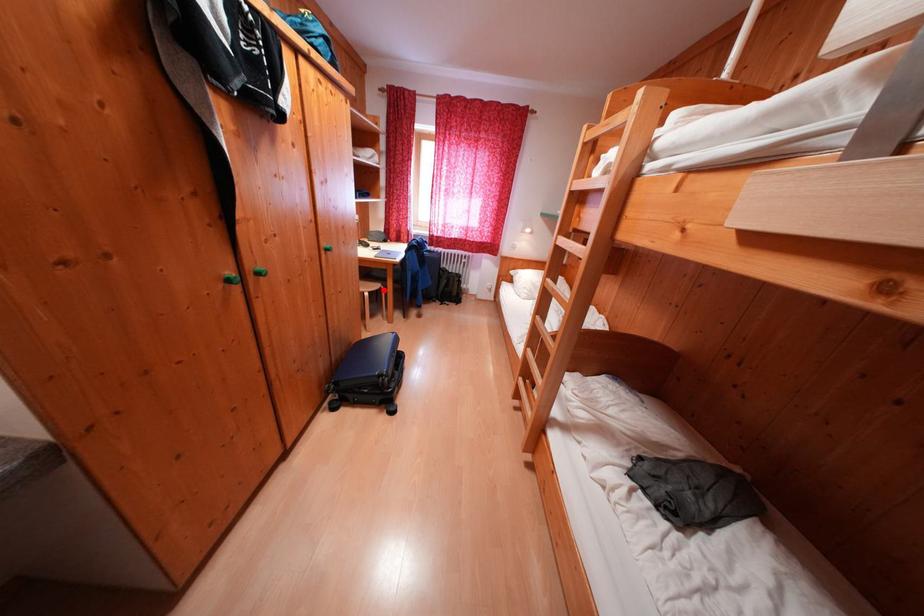
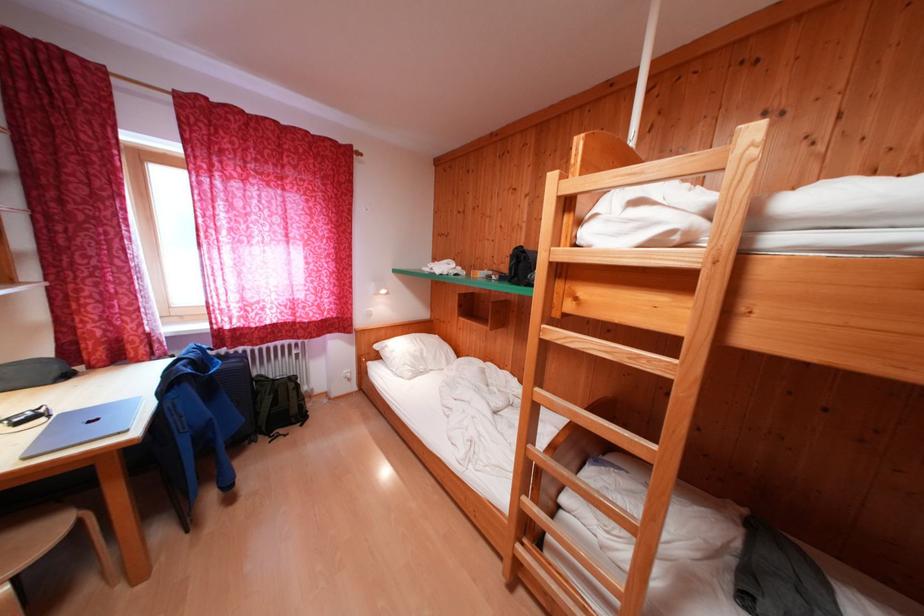
Question: I am providing you with two images of the same scene from different viewpoints. In image1, a red point is highlighted. Considering the same 3D point in image2, which of the following is correct?

Choices:
 (A) It is closer
 (B) It is farther

Answer: (B)